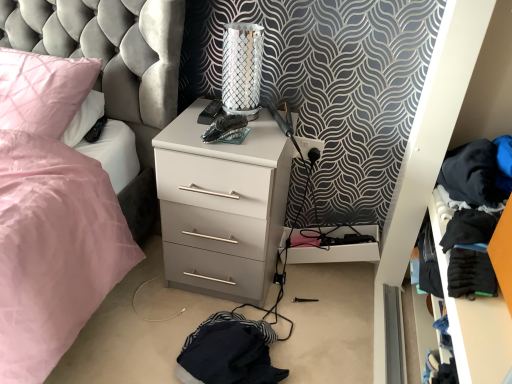
Question: Considering the relative sizes of pink satin pillow at upper left and black fabric clothes at right in the image provided, is pink satin pillow at upper left taller than black fabric clothes at right?

Choices:
 (A) no
 (B) yes

Answer: (A)

Question: Can you confirm if pink satin pillow at upper left is positioned to the left of black fabric clothes at right?

Choices:
 (A) yes
 (B) no

Answer: (A)

Question: Is pink satin pillow at upper left outside black fabric clothes at right?

Choices:
 (A) yes
 (B) no

Answer: (A)

Question: Does pink satin pillow at upper left have a greater width compared to black fabric clothes at right?

Choices:
 (A) no
 (B) yes

Answer: (B)

Question: Is black fabric clothes at right located within pink satin pillow at upper left?

Choices:
 (A) yes
 (B) no

Answer: (B)

Question: Is pink satin pillow at upper left smaller than black fabric clothes at right?

Choices:
 (A) yes
 (B) no

Answer: (B)

Question: From the image's perspective, is silver metallic table lamp at upper center located above black fabric clothes at right?

Choices:
 (A) no
 (B) yes

Answer: (B)

Question: Does silver metallic table lamp at upper center appear on the right side of black fabric clothes at right?

Choices:
 (A) no
 (B) yes

Answer: (A)

Question: From the image's perspective, would you say silver metallic table lamp at upper center is shown under black fabric clothes at right?

Choices:
 (A) yes
 (B) no

Answer: (B)

Question: Does silver metallic table lamp at upper center have a lesser height compared to black fabric clothes at right?

Choices:
 (A) no
 (B) yes

Answer: (B)

Question: Is black fabric clothes at right a part of silver metallic table lamp at upper center?

Choices:
 (A) no
 (B) yes

Answer: (A)

Question: Is silver metallic table lamp at upper center beside black fabric clothes at right?

Choices:
 (A) yes
 (B) no

Answer: (B)

Question: Is pink satin pillow at upper left completely or partially inside white matte chest of drawers at center?

Choices:
 (A) yes
 (B) no

Answer: (B)